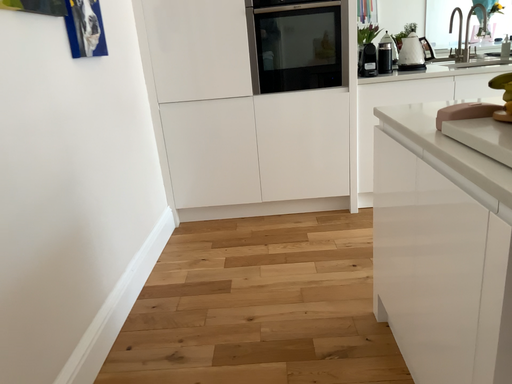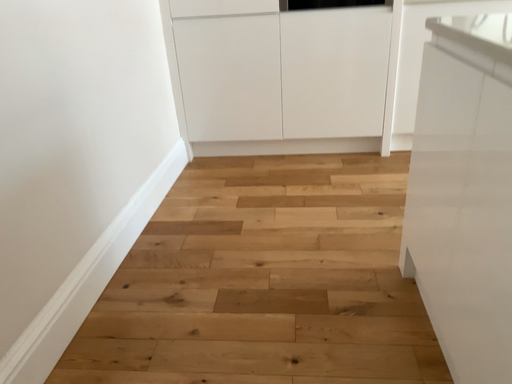
Question: How did the camera likely rotate when shooting the video?

Choices:
 (A) rotated upward
 (B) rotated downward

Answer: (B)